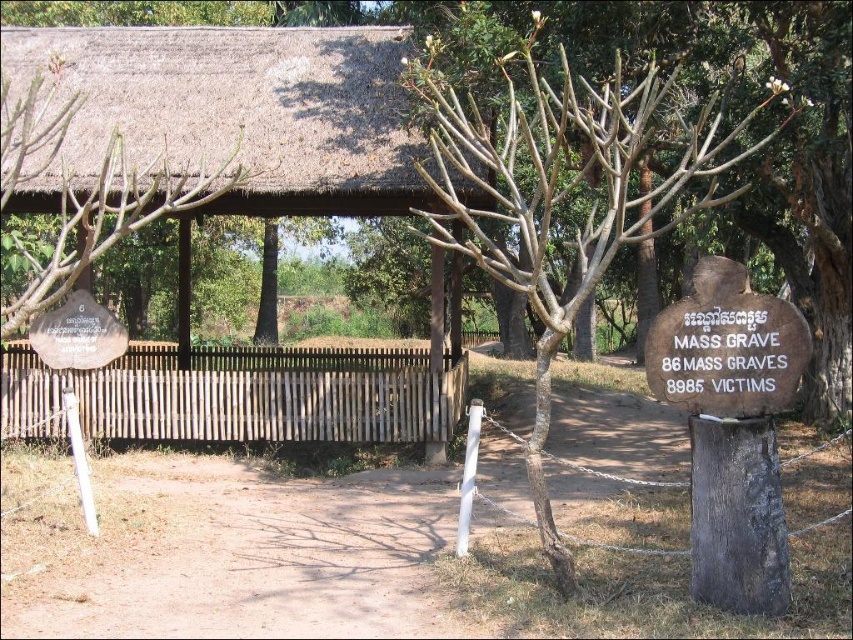
Looking at this image, you are a visitor at this memorial site and want to take a photo that includes both the brown bark tree at center and the brown wooden fence at center. Which object should you position closer to the camera to ensure both are in frame?

To include both the brown bark tree at center and the brown wooden fence at center in the photo, position the brown bark tree at center closer to the camera since it is larger in size than the brown wooden fence at center, allowing both to fit within the frame.